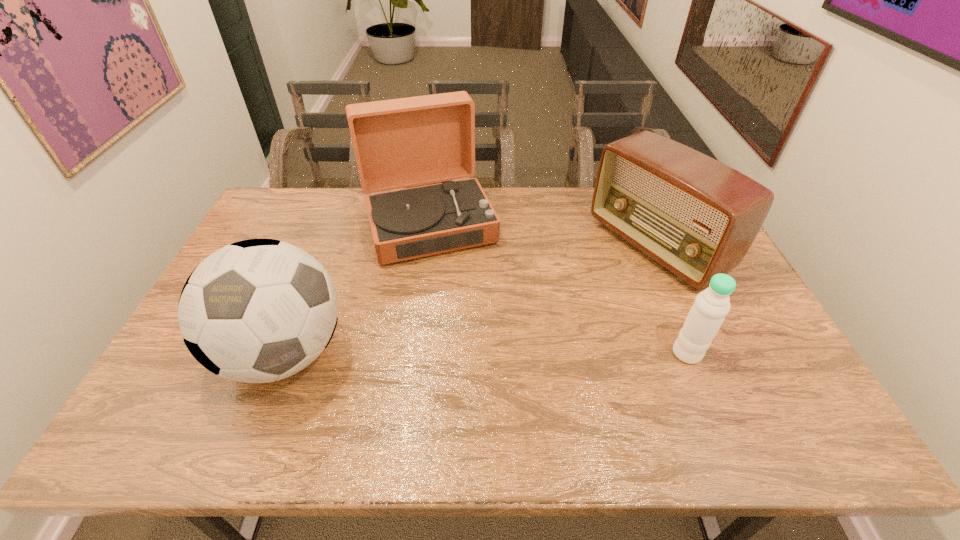
Locate an element on the screen. This screenshot has height=540, width=960. vacant space on the desktop that is between the soccer ball and the water bottle and is positioned on the front-facing side of the radio receiver is located at coordinates (457, 353).

Find the location of a particular element. free space on the desktop that is between the soccer ball and the water bottle and is positioned on the face of the phonograph record is located at coordinates (476, 353).